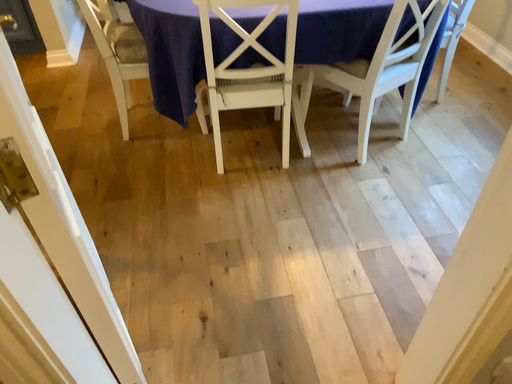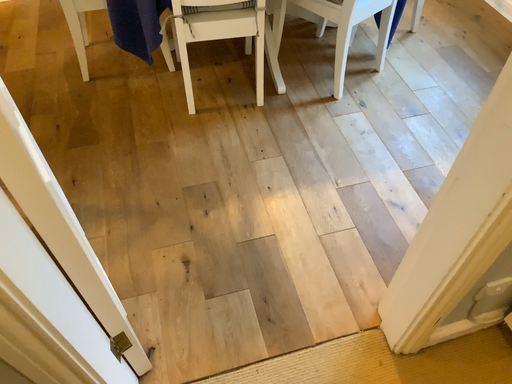
Question: Which way did the camera rotate in the video?

Choices:
 (A) rotated downward
 (B) rotated upward

Answer: (A)